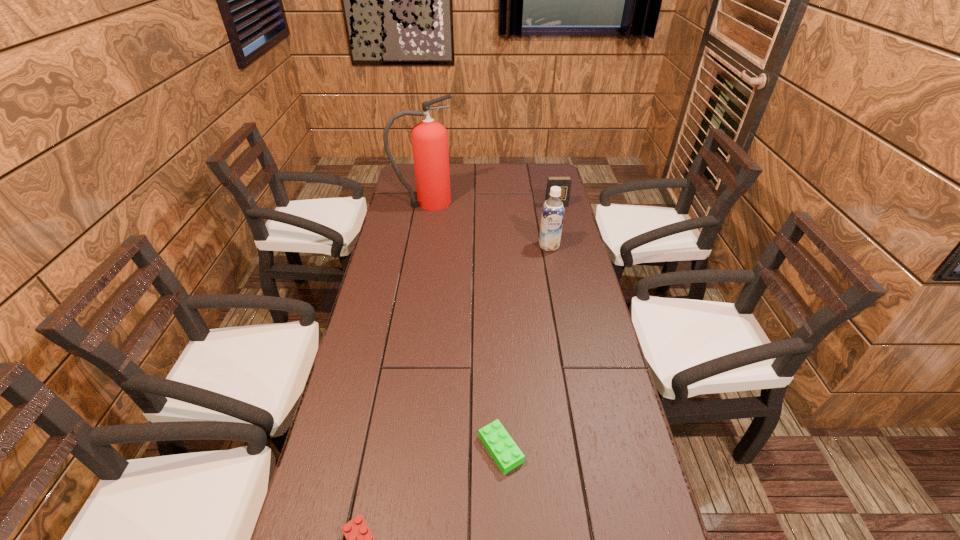
Locate an element on the screen. fire extinguisher is located at coordinates (429, 138).

At what (x,y) coordinates should I click in order to perform the action: click on soya milk. Please return your answer as a coordinate pair (x, y). This screenshot has height=540, width=960. Looking at the image, I should click on (552, 216).

Where is `the second tallest object`? The width and height of the screenshot is (960, 540). the second tallest object is located at coordinates (552, 216).

Locate an element on the screen. The image size is (960, 540). the third shortest object is located at coordinates (564, 182).

Locate an element on the screen. the right Lego is located at coordinates (505, 452).

The width and height of the screenshot is (960, 540). Identify the location of the second nearest object. (505, 452).

Locate an element on the screen. The image size is (960, 540). free region located on the handle side of the tallest object is located at coordinates (492, 202).

Find the location of a particular element. free location located 0.170m on the label of the soya milk is located at coordinates (556, 283).

Locate an element on the screen. free space located 0.310m on the front cover of the diary is located at coordinates (567, 252).

Locate an element on the screen. vacant region located 0.110m on the right of the fourth farthest object is located at coordinates (569, 449).